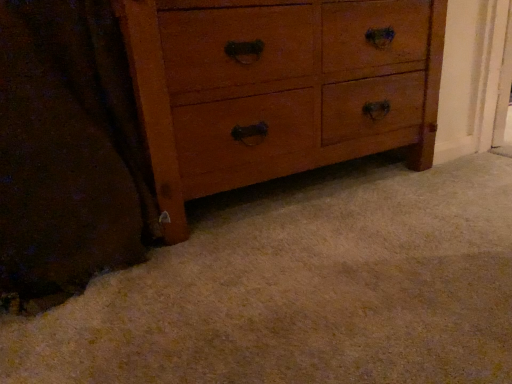
I want to click on dark brown fabric at lower left, so click(67, 153).

The width and height of the screenshot is (512, 384). Describe the element at coordinates (67, 153) in the screenshot. I see `dark brown fabric at lower left` at that location.

You are a GUI agent. You are given a task and a screenshot of the screen. Output one action in this format:
    pyautogui.click(x=<x>, y=<y>)
    Task: Click on the dark brown fabric at lower left
    This screenshot has height=384, width=512.
    Given the screenshot: What is the action you would take?
    pyautogui.click(x=67, y=153)